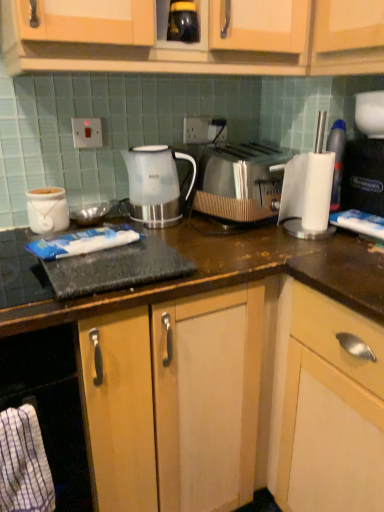
Question: Is the depth of white plastic electric outlet at upper center, which ranks as the 1th electric outlet in back-to-front order, less than that of white glossy jar at left?

Choices:
 (A) yes
 (B) no

Answer: (B)

Question: Can you confirm if white plastic electric outlet at upper center, which ranks as the 1th electric outlet in back-to-front order, is bigger than white glossy jar at left?

Choices:
 (A) yes
 (B) no

Answer: (B)

Question: Does white plastic electric outlet at upper center, positioned as the 1th electric outlet in right-to-left order, have a lesser width compared to white glossy jar at left?

Choices:
 (A) no
 (B) yes

Answer: (B)

Question: Does white plastic electric outlet at upper center, which ranks as the 1th electric outlet in back-to-front order, appear on the right side of white glossy jar at left?

Choices:
 (A) yes
 (B) no

Answer: (A)

Question: Can white glossy jar at left be found inside white plastic electric outlet at upper center, arranged as the 2th electric outlet when viewed from the left?

Choices:
 (A) no
 (B) yes

Answer: (A)

Question: From a real-world perspective, is white plastic electric outlet at upper center, positioned as the 1th electric outlet in right-to-left order, over white glossy jar at left?

Choices:
 (A) yes
 (B) no

Answer: (A)

Question: Is translucent plastic kettle at center positioned before black plastic coffee machine at right?

Choices:
 (A) yes
 (B) no

Answer: (B)

Question: Is translucent plastic kettle at center wider than black plastic coffee machine at right?

Choices:
 (A) yes
 (B) no

Answer: (B)

Question: From a real-world perspective, is translucent plastic kettle at center positioned under black plastic coffee machine at right based on gravity?

Choices:
 (A) yes
 (B) no

Answer: (A)

Question: Is translucent plastic kettle at center positioned beyond the bounds of black plastic coffee machine at right?

Choices:
 (A) yes
 (B) no

Answer: (A)

Question: Is black plastic coffee machine at right at the back of translucent plastic kettle at center?

Choices:
 (A) no
 (B) yes

Answer: (A)

Question: Is translucent plastic kettle at center at the right side of black plastic coffee machine at right?

Choices:
 (A) no
 (B) yes

Answer: (A)

Question: Is white plastic switch at upper center, the first electric outlet positioned from the left, thinner than white plastic cup at right?

Choices:
 (A) no
 (B) yes

Answer: (B)